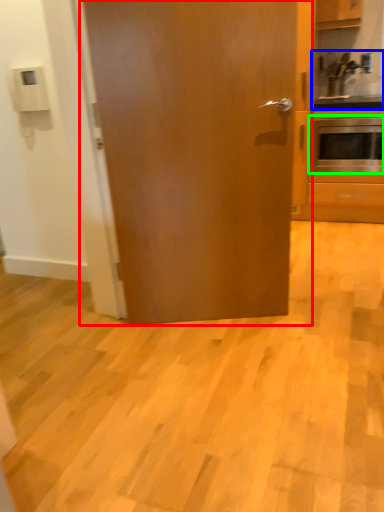
Question: Considering the real-world distances, which object is farthest from door (highlighted by a red box)? sink (highlighted by a blue box) or oven (highlighted by a green box)?

Choices:
 (A) sink
 (B) oven

Answer: (A)